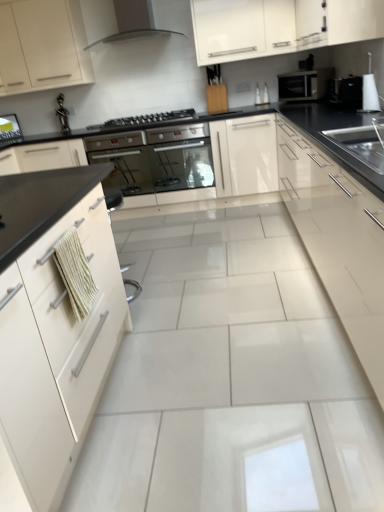
Question: From a real-world perspective, is white glossy kettle at upper right, which is counted as the 1th appliance, starting from the front, on top of white glossy cabinet at left, placed as the 2th cabinetry when sorted from left to right?

Choices:
 (A) yes
 (B) no

Answer: (A)

Question: Is white glossy kettle at upper right, which is counted as the 1th appliance, starting from the front, facing towards white glossy cabinet at left, placed as the 2th cabinetry when sorted from left to right?

Choices:
 (A) no
 (B) yes

Answer: (A)

Question: Considering the relative sizes of white glossy kettle at upper right, the 2th appliance when ordered from back to front, and white glossy cabinet at left, the 3th cabinetry viewed from the right, in the image provided, is white glossy kettle at upper right, the 2th appliance when ordered from back to front, shorter than white glossy cabinet at left, the 3th cabinetry viewed from the right,?

Choices:
 (A) yes
 (B) no

Answer: (A)

Question: From a real-world perspective, is white glossy kettle at upper right, which is counted as the 1th appliance, starting from the front, positioned under white glossy cabinet at left, placed as the 2th cabinetry when sorted from left to right, based on gravity?

Choices:
 (A) yes
 (B) no

Answer: (B)

Question: Does white glossy kettle at upper right, which is counted as the 1th appliance, starting from the front, come in front of white glossy cabinet at left, the 3th cabinetry viewed from the right?

Choices:
 (A) no
 (B) yes

Answer: (A)

Question: Which is correct: white glossy cabinet at upper center, the 2th cabinetry when ordered from right to left, is inside stainless steel oven at center, the 2th oven when ordered from right to left, or outside of it?

Choices:
 (A) inside
 (B) outside

Answer: (B)

Question: From the image's perspective, is white glossy cabinet at upper center, the 2th cabinetry when ordered from right to left, located above or below stainless steel oven at center, the 2th oven when ordered from right to left?

Choices:
 (A) above
 (B) below

Answer: (A)

Question: In terms of size, does white glossy cabinet at upper center, the 2th cabinetry when ordered from right to left, appear bigger or smaller than stainless steel oven at center, the 2th oven when ordered from right to left?

Choices:
 (A) big
 (B) small

Answer: (B)

Question: From a real-world perspective, is white glossy cabinet at upper center, marked as the third cabinetry in a left-to-right arrangement, above or below stainless steel oven at center, the 2th oven when ordered from right to left?

Choices:
 (A) below
 (B) above

Answer: (B)

Question: Does point [157, 123] appear closer or farther from the camera than point [187, 129]?

Choices:
 (A) farther
 (B) closer

Answer: (A)

Question: From the image's perspective, is black glass gas stove at center above or below stainless steel oven at center, the 2th oven when ordered from right to left?

Choices:
 (A) below
 (B) above

Answer: (B)

Question: Relative to stainless steel oven at center, the 2th oven when ordered from right to left, is black glass gas stove at center in front or behind?

Choices:
 (A) behind
 (B) front

Answer: (B)

Question: Would you say black glass gas stove at center is inside or outside stainless steel oven at center, the 2th oven when ordered from right to left?

Choices:
 (A) inside
 (B) outside

Answer: (B)

Question: Considering the positions of white glossy cabinet at left, placed as the 2th cabinetry when sorted from left to right, and matte black range hood at upper center in the image, is white glossy cabinet at left, placed as the 2th cabinetry when sorted from left to right, taller or shorter than matte black range hood at upper center?

Choices:
 (A) short
 (B) tall

Answer: (B)

Question: Which is correct: white glossy cabinet at left, placed as the 2th cabinetry when sorted from left to right, is inside matte black range hood at upper center, or outside of it?

Choices:
 (A) inside
 (B) outside

Answer: (B)